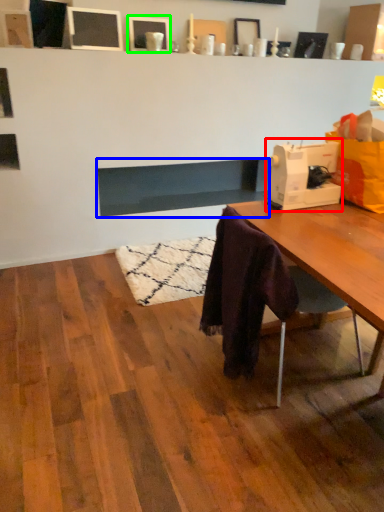
Question: Based on their relative distances, which object is farther from sewing machine (highlighted by a red box)? Choose from fireplace (highlighted by a blue box) and picture frame (highlighted by a green box).

Choices:
 (A) fireplace
 (B) picture frame

Answer: (B)